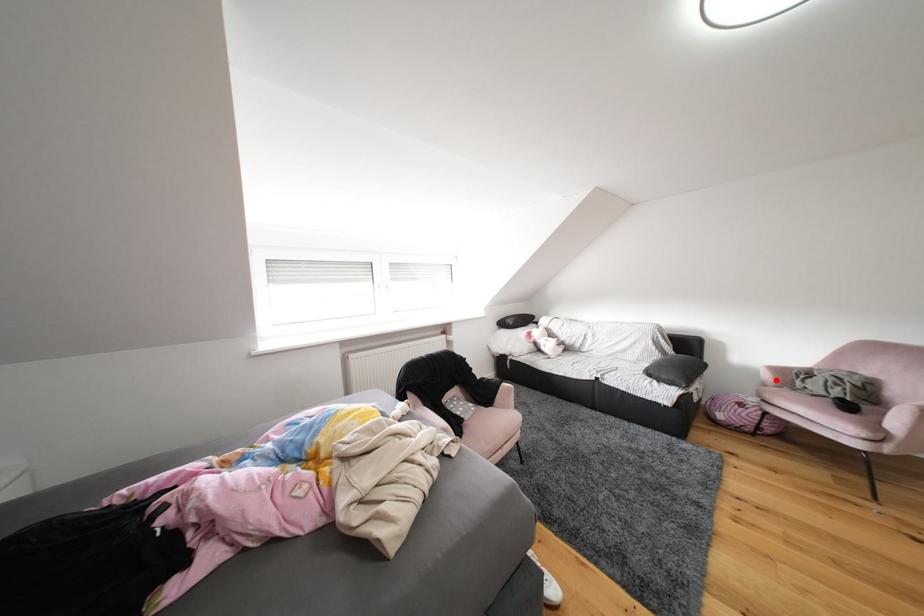
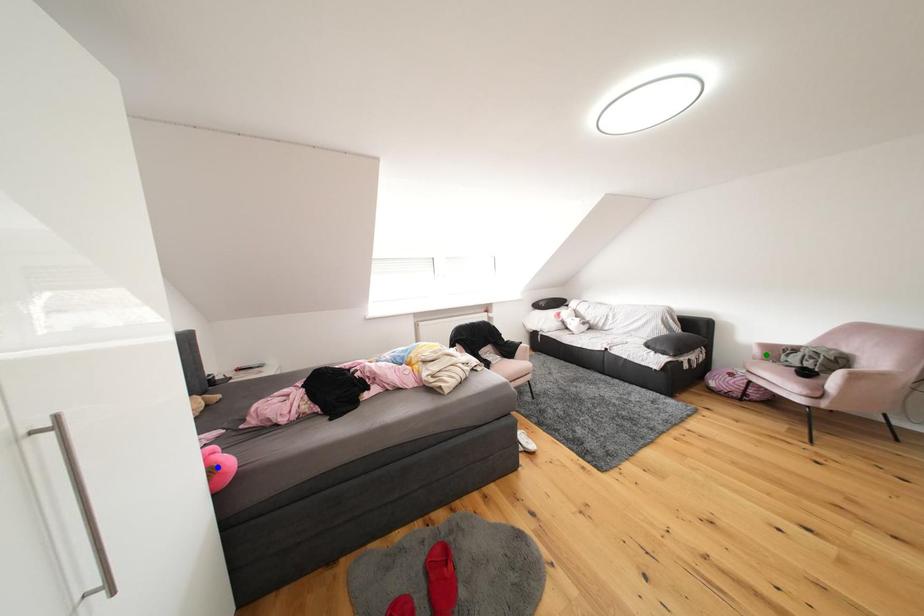
Question: I am providing you with two images of the same scene from different viewpoints. A red point is marked on the first image. You are given multiple points on the second image. In image 2, which mark is for the same physical point as the one in image 1?

Choices:
 (A) yellow point
 (B) green point
 (C) blue point

Answer: (B)